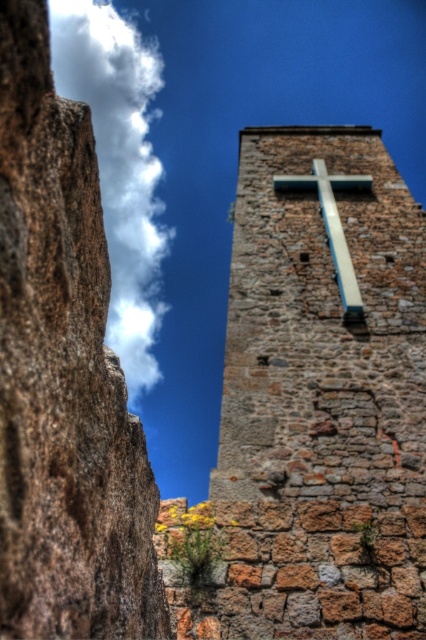
Question: Which of the following is the closest to the observer?

Choices:
 (A) (66, 83)
 (B) (293, 177)
 (C) (314, 490)

Answer: (C)

Question: Is white fluffy cloud at upper left wider than metallic silver cross at center?

Choices:
 (A) yes
 (B) no

Answer: (A)

Question: Which point is closer to the camera?

Choices:
 (A) (219, 433)
 (B) (160, 259)
 (C) (330, 204)

Answer: (A)

Question: Is white fluffy cloud at upper left positioned in front of metallic silver cross at center?

Choices:
 (A) yes
 (B) no

Answer: (A)

Question: Is white fluffy cloud at upper left above metallic silver cross at center?

Choices:
 (A) yes
 (B) no

Answer: (A)

Question: Which point is farther to the camera?

Choices:
 (A) rustic stone cross at upper center
 (B) metallic silver cross at center
 (C) white fluffy cloud at upper left

Answer: (B)